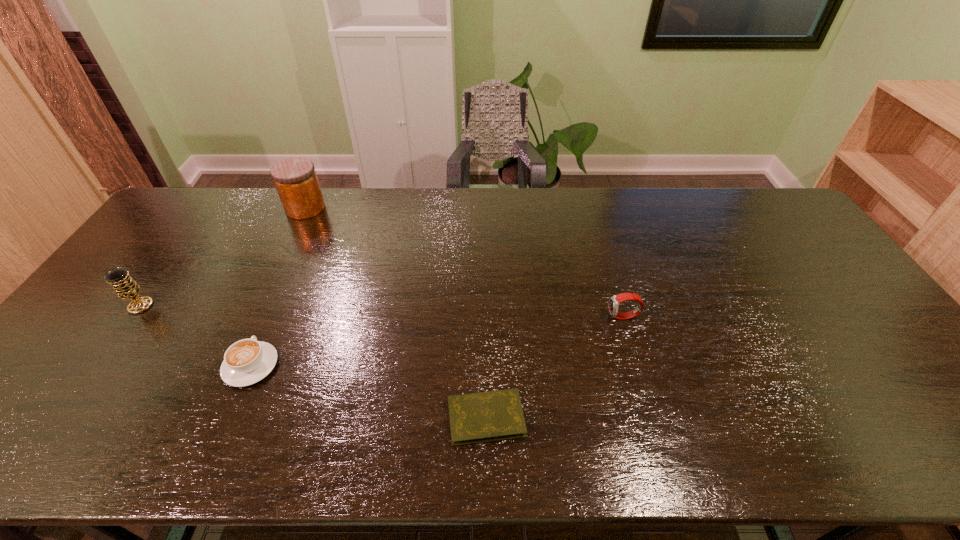
The width and height of the screenshot is (960, 540). Find the location of `object situated at the near edge`. object situated at the near edge is located at coordinates (488, 416).

Locate an element on the screen. object that is at the left edge is located at coordinates (126, 288).

This screenshot has height=540, width=960. I want to click on vacant area at the far edge, so click(x=721, y=217).

At what (x,y) coordinates should I click in order to perform the action: click on vacant space at the near edge of the desktop. Please return your answer as a coordinate pair (x, y). The height and width of the screenshot is (540, 960). Looking at the image, I should click on pyautogui.click(x=604, y=441).

Where is `free region at the left edge`? free region at the left edge is located at coordinates (133, 325).

Identify the location of free spot at the right edge of the desktop. (801, 267).

Locate an element on the screen. The image size is (960, 540). free space at the far left corner is located at coordinates pos(199,205).

Locate an element on the screen. This screenshot has width=960, height=540. vacant space at the near right corner of the desktop is located at coordinates (944, 455).

Where is `vacant space in between the jar and the watch`? The width and height of the screenshot is (960, 540). vacant space in between the jar and the watch is located at coordinates click(x=465, y=263).

The width and height of the screenshot is (960, 540). I want to click on free point between the second shortest object and the fourth shortest object, so click(x=196, y=336).